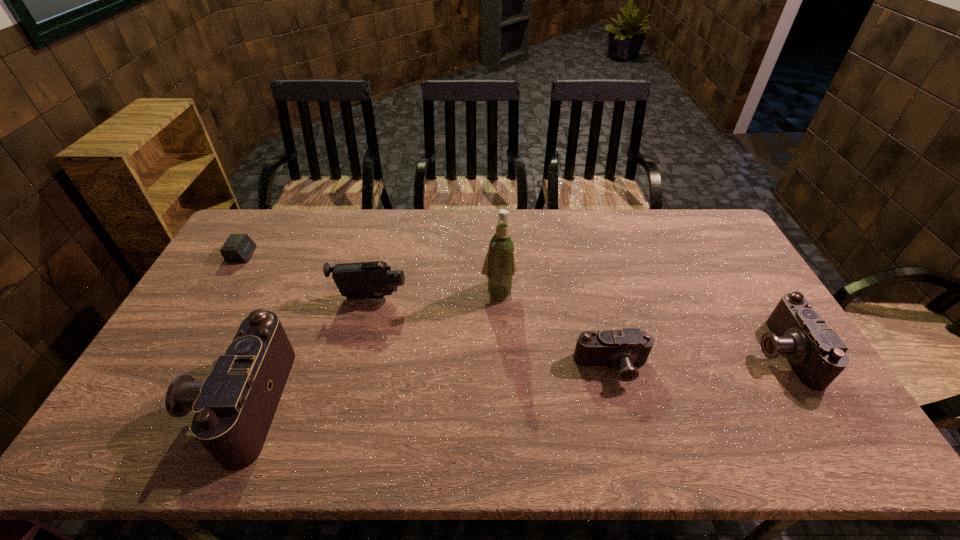
Identify the location of free space located on the front-facing side of the wine bottle. (504, 399).

Where is `object positioned at the far edge`? The width and height of the screenshot is (960, 540). object positioned at the far edge is located at coordinates [x=238, y=247].

Image resolution: width=960 pixels, height=540 pixels. I want to click on object that is at the left edge, so click(x=238, y=247).

Find the location of `object that is at the right edge`. object that is at the right edge is located at coordinates (816, 353).

Locate an element on the screen. object that is at the far left corner is located at coordinates (238, 247).

The width and height of the screenshot is (960, 540). Find the location of `object that is at the near right corner`. object that is at the near right corner is located at coordinates (816, 353).

Where is `vacant space at the far edge of the desktop`? vacant space at the far edge of the desktop is located at coordinates (365, 220).

This screenshot has width=960, height=540. I want to click on vacant space at the near edge of the desktop, so click(x=586, y=396).

At what (x,y) coordinates should I click in order to perform the action: click on blank space at the left edge of the desktop. Please return your answer as a coordinate pair (x, y). Looking at the image, I should click on (220, 288).

The image size is (960, 540). I want to click on vacant area at the right edge, so click(x=724, y=320).